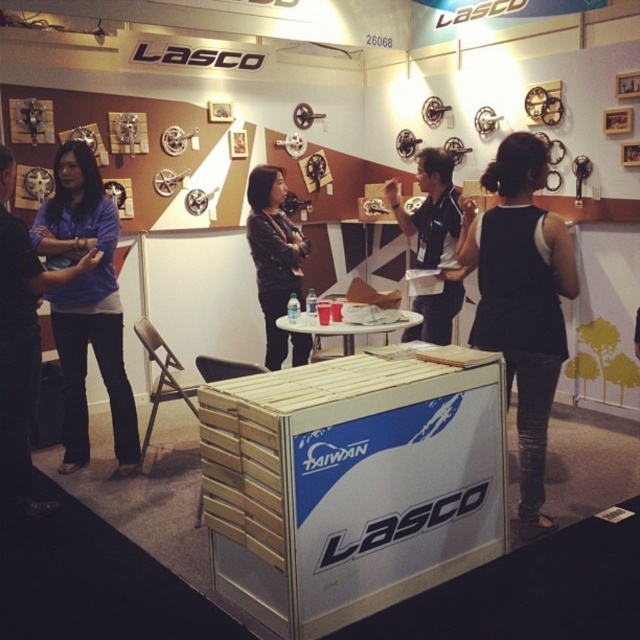
Question: Among these points, which one is nearest to the camera?

Choices:
 (A) (266, 216)
 (B) (72, 342)
 (C) (449, 196)
 (D) (548, 401)

Answer: (D)

Question: Does black fabric dress at center lie in front of black shirt at center?

Choices:
 (A) no
 (B) yes

Answer: (B)

Question: Is black fabric dress at center smaller than black leather jacket at center?

Choices:
 (A) no
 (B) yes

Answer: (A)

Question: Which object is positioned farthest from the black fabric dress at center?

Choices:
 (A) black leather jacket at center
 (B) matte blue shirt at left
 (C) black shirt at center

Answer: (B)

Question: Which point appears closest to the camera in this image?

Choices:
 (A) (513, 154)
 (B) (140, 452)
 (C) (445, 209)

Answer: (A)

Question: Can you confirm if black fabric dress at center is positioned above black shirt at center?

Choices:
 (A) no
 (B) yes

Answer: (A)